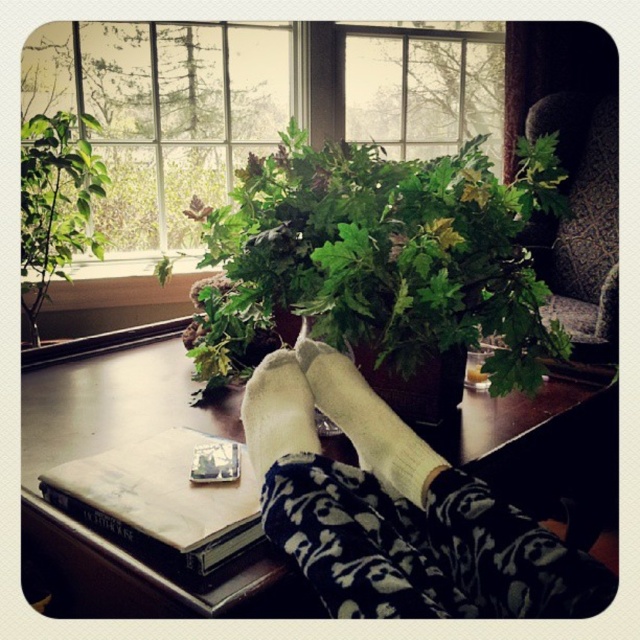
Question: Among these points, which one is farthest from the camera?

Choices:
 (A) (384, 467)
 (B) (460, 550)
 (C) (611, 285)

Answer: (C)

Question: Considering the real-world distances, which object is farthest from the green leafy plant at center?

Choices:
 (A) green leafy plant at left
 (B) transparent glass window at upper center
 (C) velvet dark brown armchair at upper right

Answer: (B)

Question: Is wooden table at center below white fuzzy socks at center?

Choices:
 (A) yes
 (B) no

Answer: (A)

Question: Can you confirm if green leafy plant at center is bigger than white sock at lower center?

Choices:
 (A) no
 (B) yes

Answer: (B)

Question: Which of the following is the closest to the observer?

Choices:
 (A) clear glass window at upper center
 (B) wooden table at center
 (C) white sock at lower center
 (D) green leafy plant at center

Answer: (B)

Question: Is hardcover book at lower left smaller than white sock at lower center?

Choices:
 (A) yes
 (B) no

Answer: (B)